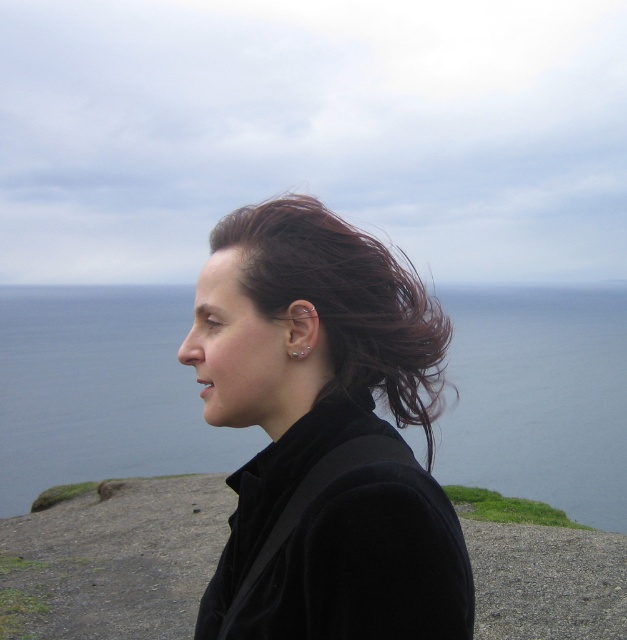
Who is taller, matte black hair at center or blue water at center?

With more height is blue water at center.

The image size is (627, 640). I want to click on matte black hair at center, so click(325, 432).

Does matte black hair at center have a smaller size compared to dark brown hair at center?

No.

Can you confirm if matte black hair at center is positioned below dark brown hair at center?

Correct, matte black hair at center is located below dark brown hair at center.

Identify the location of matte black hair at center. (325, 432).

This screenshot has width=627, height=640. Identify the location of blue water at center. (100, 390).

Between blue water at center and dark brown hair at center, which one is positioned higher?

blue water at center

Find the location of a particular element. The height and width of the screenshot is (640, 627). blue water at center is located at coordinates (100, 390).